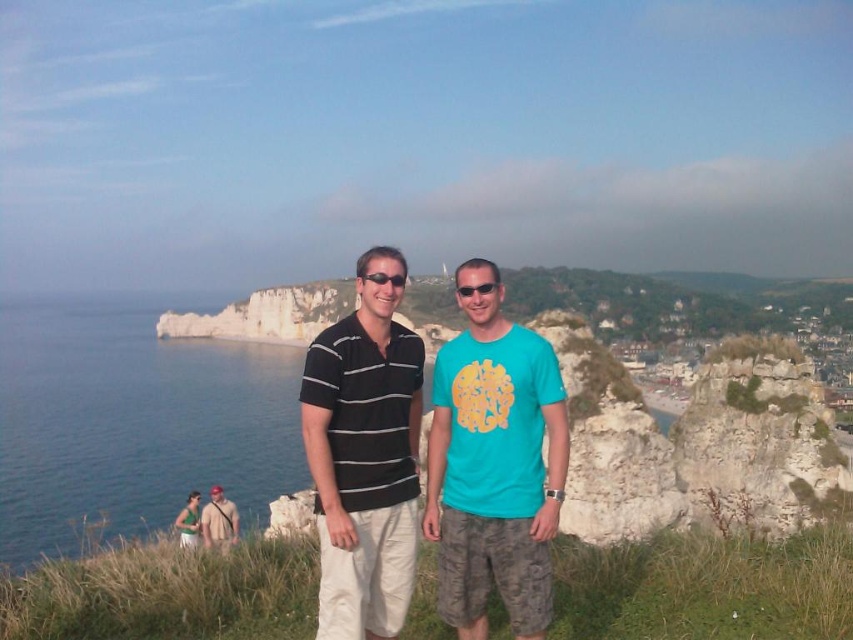
Question: Which point is closer to the camera?

Choices:
 (A) teal matte t-shirt at center
 (B) black plastic sunglasses at center

Answer: (A)

Question: Does black striped polo shirt at center appear over green fabric dress at lower left?

Choices:
 (A) yes
 (B) no

Answer: (A)

Question: Is the position of teal matte t-shirt at center less distant than that of black plastic sunglasses at center?

Choices:
 (A) yes
 (B) no

Answer: (A)

Question: Which is nearer to the black plastic sunglasses at center?

Choices:
 (A) green fabric dress at lower left
 (B) teal matte t-shirt at center
 (C) camouflage shorts at lower left
 (D) black striped polo shirt at center

Answer: (D)

Question: Does camouflage shorts at lower left appear on the left side of green fabric dress at lower left?

Choices:
 (A) yes
 (B) no

Answer: (B)

Question: Among these objects, which one is nearest to the camera?

Choices:
 (A) black plastic sunglasses at center
 (B) green fabric dress at lower left

Answer: (A)